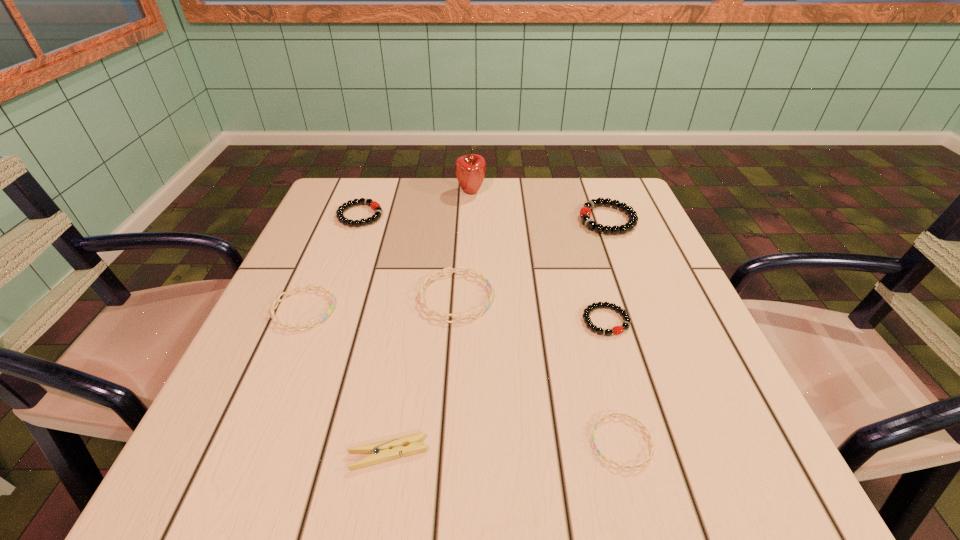
This screenshot has width=960, height=540. In order to click on the tallest object in this screenshot , I will do `click(470, 169)`.

Identify the location of apple. This screenshot has width=960, height=540. (470, 169).

Locate an element on the screen. Image resolution: width=960 pixels, height=540 pixels. the biggest black bracelet is located at coordinates (585, 212).

Locate an element on the screen. Image resolution: width=960 pixels, height=540 pixels. the biggest blue bracelet is located at coordinates (432, 312).

You are a GUI agent. You are given a task and a screenshot of the screen. Output one action in this format:
    pyautogui.click(x=<x>, y=<y>)
    Task: Click on the second blue bracelet from left to right
    This screenshot has height=540, width=960.
    Given the screenshot: What is the action you would take?
    pyautogui.click(x=432, y=312)

At what (x,y) coordinates should I click in order to perform the action: click on the second smallest black bracelet. Please return your answer as a coordinate pair (x, y). Looking at the image, I should click on (374, 205).

Identify the location of the leftmost blue bracelet. (278, 300).

Where is `the smallest black bracelet`? This screenshot has width=960, height=540. the smallest black bracelet is located at coordinates (616, 330).

Locate an element on the screen. clothespin is located at coordinates (390, 449).

You are a GUI agent. You are given a task and a screenshot of the screen. Output one action in this format:
    pyautogui.click(x=<x>, y=<y>)
    Task: Click on the shortest object
    Image resolution: width=960 pixels, height=540 pixels.
    Given the screenshot: What is the action you would take?
    pyautogui.click(x=635, y=420)